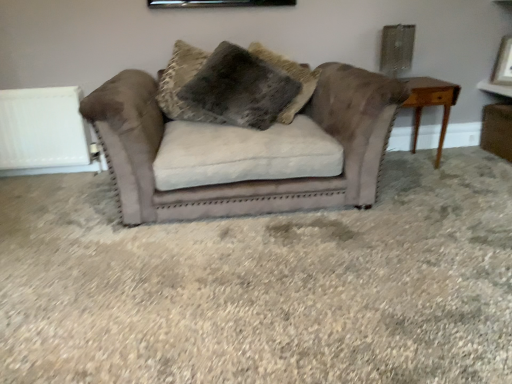
Where is `unoccupied area in front of white matte radiator at left`? unoccupied area in front of white matte radiator at left is located at coordinates (30, 185).